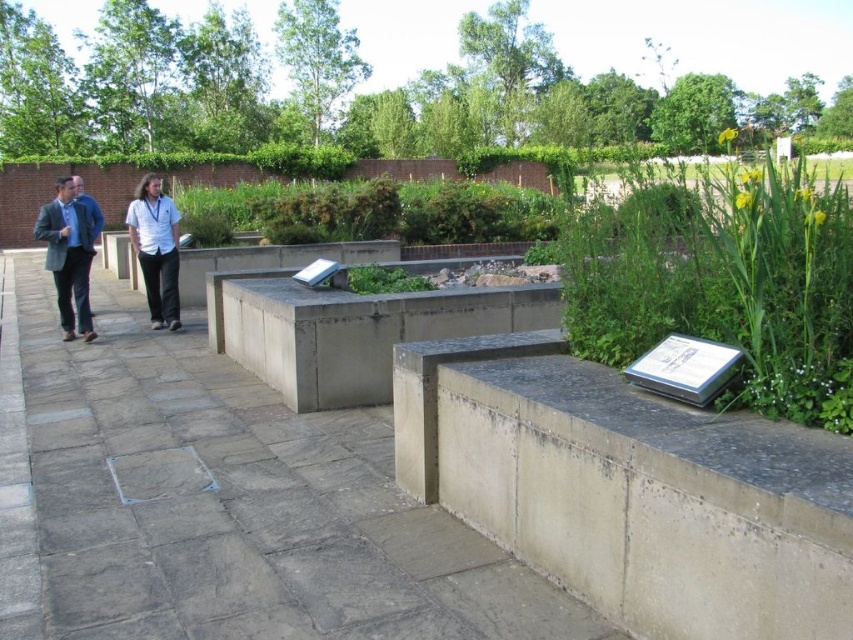
You are standing at the starting point of the garden walkway and see two points marked on the path ahead. The first point is at coordinate point (136, 241) and the second is at point (374, 262). If you were to walk straight ahead, which point would you encounter first?

Point (136, 241) is in front of point (374, 262), so you would encounter point (136, 241) first as you walk straight ahead.

What is located at the point with coordinates (x=723, y=280) in the image?

The point at coordinates (x=723, y=280) indicates a green leafy plant at the right.

You are standing at the entrance of the garden and want to reach a specific point marked at coordinates point (715, 221). If your walking speed is 1.2 meters per second, how long will it take you to reach that point?

The distance of point (715, 221) from viewer is 3.38 meters. At a speed of 1.2 meters per second, it will take approximately 2.82 seconds to reach the point.